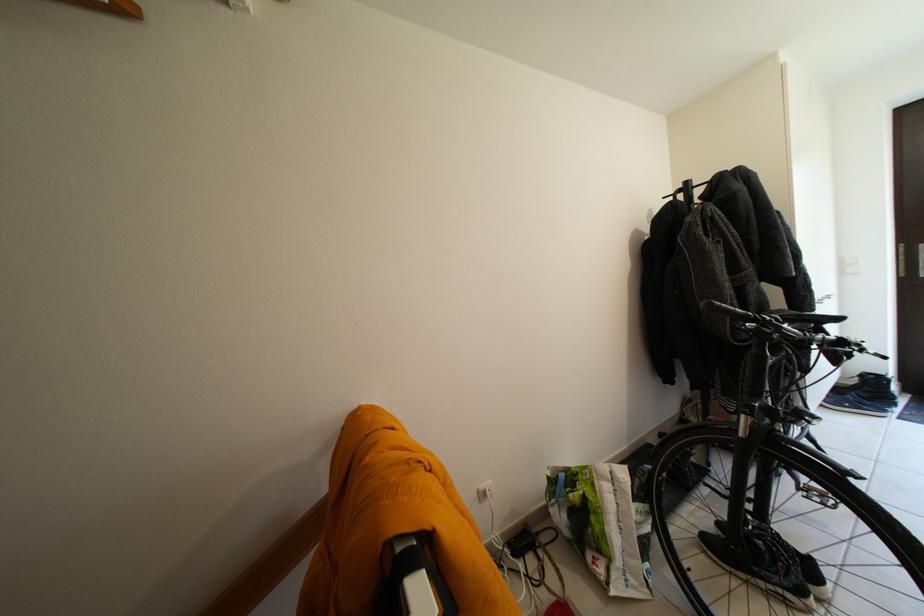
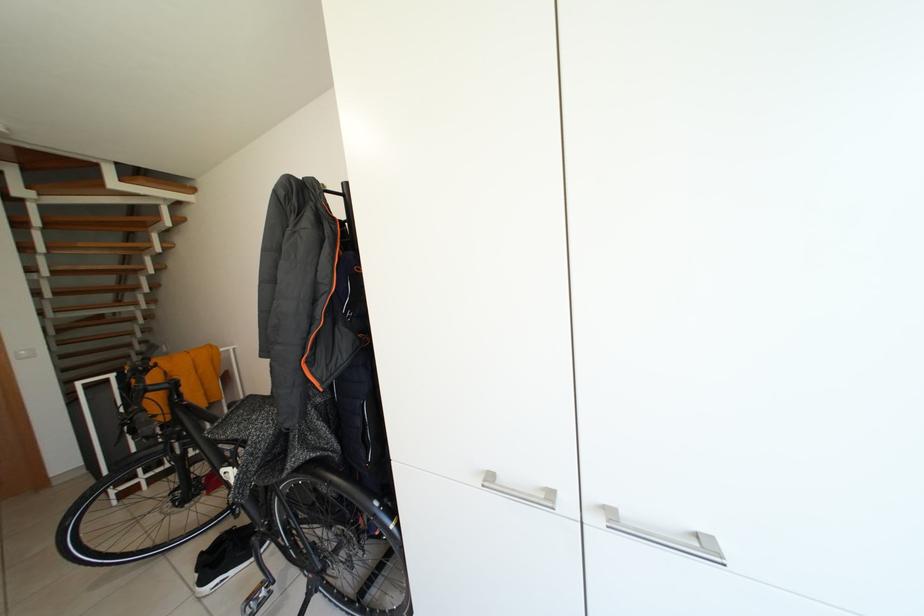
Question: I am providing you with two images of the same scene from different viewpoints. Which of the following objects are not visible in image2?

Choices:
 (A) wooden coat hanger
 (B) silver cabinet handle
 (C) light wood chair sitting surface
 (D) bicycle pedal

Answer: (A)